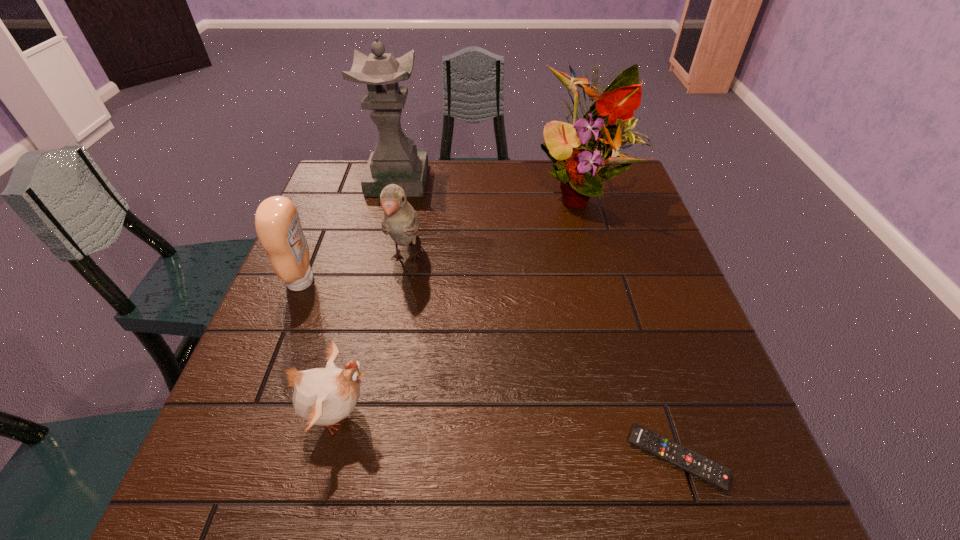
The image size is (960, 540). Identify the location of bouquet that is at the right edge. (582, 159).

Identify the location of remote control present at the right edge. (688, 460).

Where is `object that is at the far left corner`? This screenshot has width=960, height=540. object that is at the far left corner is located at coordinates click(x=395, y=160).

Find the location of a particular element. Image resolution: width=960 pixels, height=540 pixels. object that is at the near left corner is located at coordinates [x=322, y=396].

Locate an element on the screen. object located in the far right corner section of the desktop is located at coordinates (582, 159).

This screenshot has width=960, height=540. Identify the location of object present at the near right corner. (688, 460).

This screenshot has width=960, height=540. Find the location of `free region at the far edge`. free region at the far edge is located at coordinates (425, 198).

Identify the location of vacant space at the near edge. This screenshot has width=960, height=540. (519, 505).

This screenshot has height=540, width=960. I want to click on vacant space at the left edge of the desktop, so [330, 217].

Locate an element on the screen. The image size is (960, 540). vacant space at the right edge of the desktop is located at coordinates pyautogui.click(x=628, y=271).